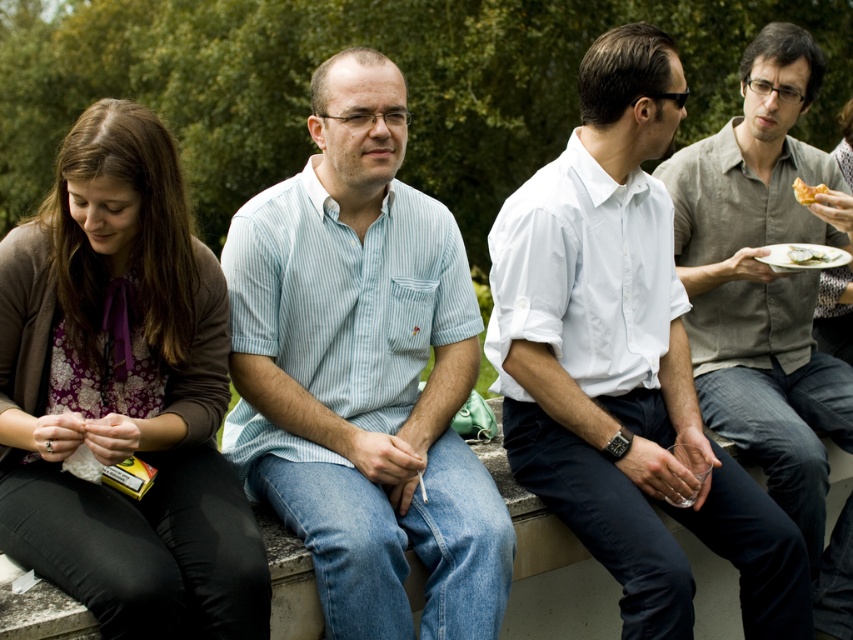
Question: Does light blue striped shirt at center lie in front of matte black plate at right?

Choices:
 (A) no
 (B) yes

Answer: (B)

Question: Which object is farther from the camera taking this photo?

Choices:
 (A) matte brown sweater at left
 (B) white shirt at center

Answer: (B)

Question: Which point is farther to the camera?

Choices:
 (A) matte brown sweater at left
 (B) white shirt at center
 (C) light blue striped shirt at center

Answer: (B)

Question: Does matte black plate at right appear on the right side of white ceramic plate at upper right?

Choices:
 (A) yes
 (B) no

Answer: (A)

Question: Can you confirm if matte brown sweater at left is smaller than matte gray shirt at right?

Choices:
 (A) yes
 (B) no

Answer: (A)

Question: Which object is positioned farthest from the golden crispy pastry at upper right?

Choices:
 (A) matte brown sweater at left
 (B) white shirt at center
 (C) matte gray shirt at right

Answer: (A)